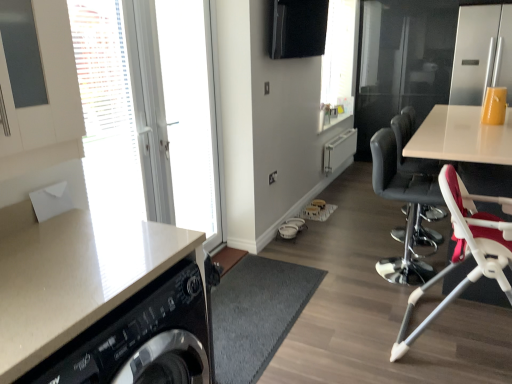
The image size is (512, 384). What are the coordinates of `free space above black glossy washing machine at lower left (from a real-world perspective)` in the screenshot? It's located at (249, 308).